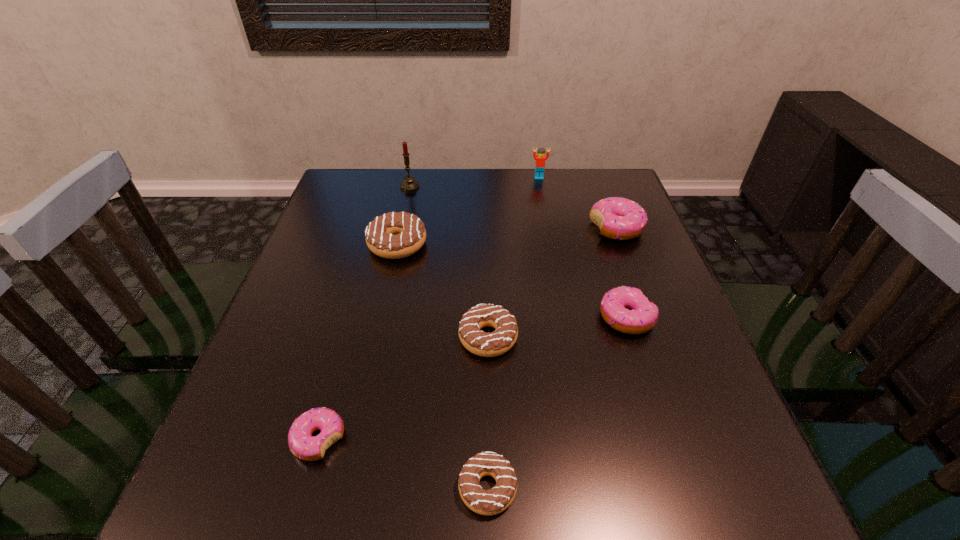
You are a GUI agent. You are given a task and a screenshot of the screen. Output one action in this format:
    pyautogui.click(x=<x>, y=<y>)
    Task: Click on the seventh nearest object
    
    Given the screenshot: What is the action you would take?
    pyautogui.click(x=409, y=184)

The width and height of the screenshot is (960, 540). What are the coordinates of `candle` in the screenshot? It's located at (409, 184).

In order to click on red Lego in this screenshot , I will do `click(540, 159)`.

Locate an element on the screen. This screenshot has height=540, width=960. the second tallest object is located at coordinates (540, 159).

Where is `the farthest pink doughnut`? the farthest pink doughnut is located at coordinates (618, 218).

Image resolution: width=960 pixels, height=540 pixels. I want to click on the farthest chocolate doughnut, so click(394, 235).

Locate an element on the screen. This screenshot has height=540, width=960. the biggest chocolate doughnut is located at coordinates (394, 235).

Find the location of `the second biggest pink doughnut`. the second biggest pink doughnut is located at coordinates (642, 315).

Where is `the second smallest chocolate doughnut`? the second smallest chocolate doughnut is located at coordinates (478, 342).

The image size is (960, 540). I want to click on the smallest pink doughnut, so click(302, 444).